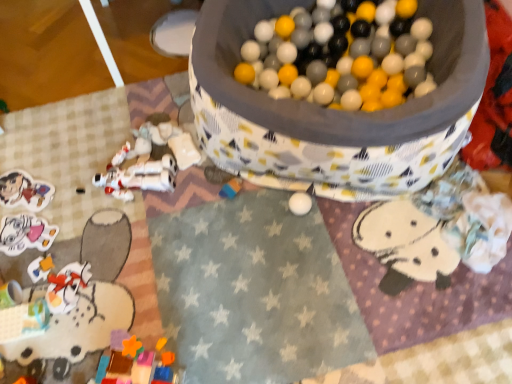
Question: From the image's perspective, does matte cardboard sticker at lower left, which is the sixth toy from right to left, appear higher than matte white sticker at lower left, which appears as the 2th toy when viewed from the left?

Choices:
 (A) yes
 (B) no

Answer: (A)

Question: Does matte cardboard sticker at lower left, which is the first toy in left-to-right order, have a greater height compared to matte white sticker at lower left, the 5th toy when ordered from right to left?

Choices:
 (A) no
 (B) yes

Answer: (A)

Question: Is matte cardboard sticker at lower left, which is the first toy in left-to-right order, closer to the viewer compared to matte white sticker at lower left, the 5th toy when ordered from right to left?

Choices:
 (A) no
 (B) yes

Answer: (A)

Question: Is the position of matte cardboard sticker at lower left, which is the sixth toy from right to left, more distant than that of matte white sticker at lower left, the 5th toy when ordered from right to left?

Choices:
 (A) no
 (B) yes

Answer: (B)

Question: Does matte cardboard sticker at lower left, which is the sixth toy from right to left, have a greater width compared to matte white sticker at lower left, the 5th toy when ordered from right to left?

Choices:
 (A) no
 (B) yes

Answer: (B)

Question: Considering the relative positions of plastic toy figure at lower left, placed as the fourth toy when sorted from right to left, and matte white sticker at lower left, which appears as the 2th toy when viewed from the left, in the image provided, is plastic toy figure at lower left, placed as the fourth toy when sorted from right to left, to the left or to the right of matte white sticker at lower left, which appears as the 2th toy when viewed from the left,?

Choices:
 (A) right
 (B) left

Answer: (A)

Question: Would you say plastic toy figure at lower left, positioned as the third toy in left-to-right order, is inside or outside matte white sticker at lower left, the 5th toy when ordered from right to left?

Choices:
 (A) outside
 (B) inside

Answer: (A)

Question: From the image's perspective, is plastic toy figure at lower left, positioned as the third toy in left-to-right order, located above or below matte white sticker at lower left, which appears as the 2th toy when viewed from the left?

Choices:
 (A) above
 (B) below

Answer: (B)

Question: Considering their positions, is plastic toy figure at lower left, positioned as the third toy in left-to-right order, located in front of or behind matte white sticker at lower left, the 5th toy when ordered from right to left?

Choices:
 (A) front
 (B) behind

Answer: (A)

Question: Considering the positions of matte cardboard sticker at lower left, which is the first toy in left-to-right order, and white plastic astronaut at lower left, placed as the 3th toy when sorted from right to left, in the image, is matte cardboard sticker at lower left, which is the first toy in left-to-right order, bigger or smaller than white plastic astronaut at lower left, placed as the 3th toy when sorted from right to left,?

Choices:
 (A) big
 (B) small

Answer: (B)

Question: From a real-world perspective, is matte cardboard sticker at lower left, which is the first toy in left-to-right order, above or below white plastic astronaut at lower left, placed as the 4th toy when sorted from left to right?

Choices:
 (A) above
 (B) below

Answer: (B)

Question: Would you say matte cardboard sticker at lower left, which is the first toy in left-to-right order, is inside or outside white plastic astronaut at lower left, placed as the 3th toy when sorted from right to left?

Choices:
 (A) inside
 (B) outside

Answer: (B)

Question: Considering the positions of matte cardboard sticker at lower left, which is the sixth toy from right to left, and white plastic astronaut at lower left, placed as the 4th toy when sorted from left to right, in the image, is matte cardboard sticker at lower left, which is the sixth toy from right to left, wider or thinner than white plastic astronaut at lower left, placed as the 4th toy when sorted from left to right,?

Choices:
 (A) thin
 (B) wide

Answer: (A)

Question: From a real-world perspective, is multicolored plastic blocks at center, the 2th toy positioned from the right, physically located above or below fluffy white blanket at lower right, arranged as the 1th toy when viewed from the right?

Choices:
 (A) above
 (B) below

Answer: (B)

Question: Is multicolored plastic blocks at center, the 2th toy positioned from the right, in front of or behind fluffy white blanket at lower right, arranged as the 1th toy when viewed from the right, in the image?

Choices:
 (A) behind
 (B) front

Answer: (A)